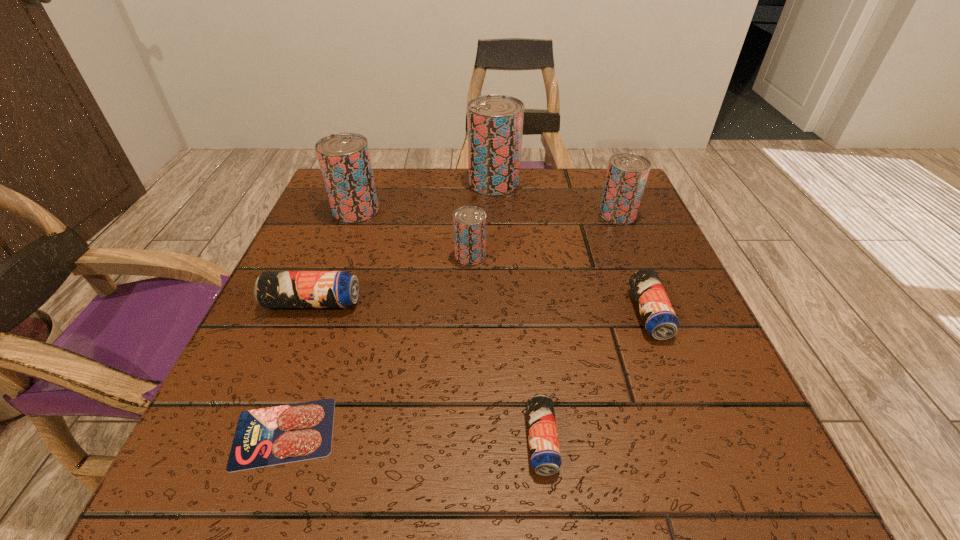
Where is `the sixth tallest object`? the sixth tallest object is located at coordinates (659, 318).

In order to click on the second biggest blue beer can in this screenshot , I will do `click(659, 318)`.

Image resolution: width=960 pixels, height=540 pixels. I want to click on the second shortest object, so click(545, 456).

The image size is (960, 540). Identify the location of the shortest beer can. (545, 456).

Locate an element on the screen. the shortest object is located at coordinates (269, 436).

Locate an element on the screen. Image resolution: width=960 pixels, height=540 pixels. free space located 0.060m on the right of the farthest red beer can is located at coordinates (543, 183).

The image size is (960, 540). I want to click on free space located 0.050m on the back of the second tallest beer can, so click(x=365, y=187).

This screenshot has height=540, width=960. Identify the location of blank space located on the front of the rightmost red beer can. (655, 307).

The image size is (960, 540). In order to click on free space located 0.170m on the front of the fourth tallest object in this screenshot , I will do `click(468, 331)`.

Locate an element on the screen. This screenshot has height=540, width=960. free spot located 0.050m on the right of the fifth tallest beer can is located at coordinates (386, 303).